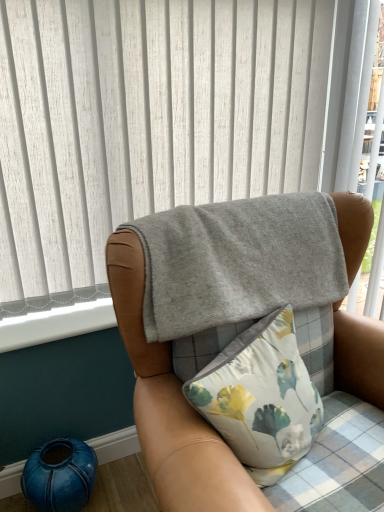
Question: Looking at their shapes, would you say floral fabric pillow at center is wider or thinner than gray fleece blanket at upper center?

Choices:
 (A) thin
 (B) wide

Answer: (A)

Question: In the image, is floral fabric pillow at center on the left side or the right side of gray fleece blanket at upper center?

Choices:
 (A) left
 (B) right

Answer: (A)

Question: Which object is positioned closest to the floral fabric pillow at center?

Choices:
 (A) gray felt blanket at upper center
 (B) gray fleece blanket at upper center
 (C) teal ceramic vase at lower left
 (D) white smooth window sill at lower left

Answer: (B)

Question: Which is nearer to the floral fabric pillow at center?

Choices:
 (A) gray felt blanket at upper center
 (B) white smooth window sill at lower left
 (C) teal ceramic vase at lower left
 (D) gray fleece blanket at upper center

Answer: (D)